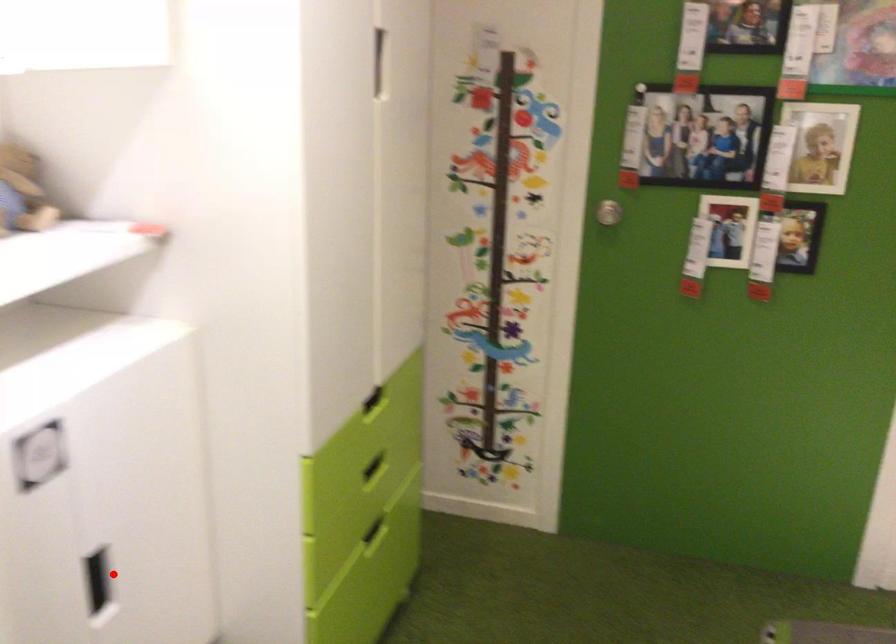
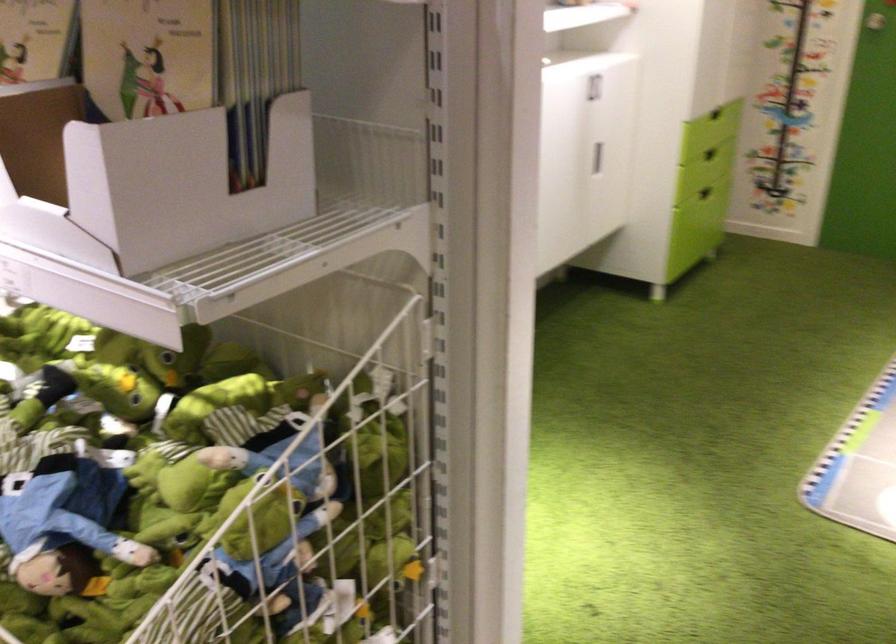
Question: I am providing you with two images of the same scene from different viewpoints. Given a red point in image1, look at the same physical point in image2. Is it:

Choices:
 (A) Closer to the viewpoint
 (B) Farther from the viewpoint

Answer: (B)